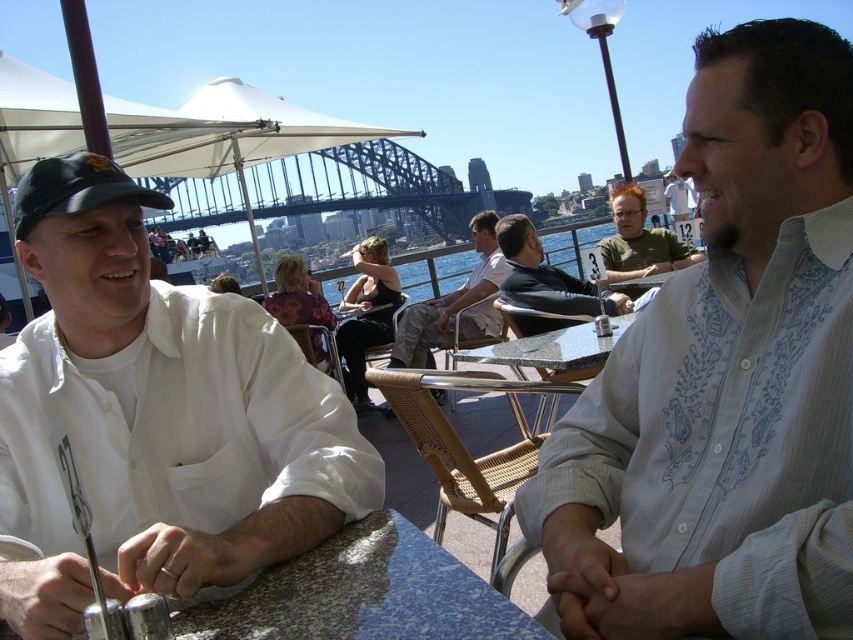
Who is positioned more to the right, white matte shirt at left or dark gray shirt at center?

dark gray shirt at center is more to the right.

Who is more distant from viewer, (109, 248) or (514, 243)?

The point (514, 243) is behind.

What are the coordinates of `white matte shirt at left` in the screenshot? It's located at (154, 417).

Does white embroidered shirt at center have a greater height compared to dark gray shirt at center?

Indeed, white embroidered shirt at center has a greater height compared to dark gray shirt at center.

Does point (556, 484) come behind point (541, 282)?

No, (556, 484) is in front of (541, 282).

The image size is (853, 640). In order to click on white embroidered shirt at center in this screenshot , I will do `click(724, 378)`.

Which is above, white matte shirt at left or green t-shirt at center?

green t-shirt at center is above.

Which is in front, point (138, 518) or point (631, 273)?

Point (138, 518) is more forward.

Who is more forward, (193, 540) or (624, 184)?

Point (193, 540) is more forward.

Find the location of a particular element. white matte shirt at left is located at coordinates (154, 417).